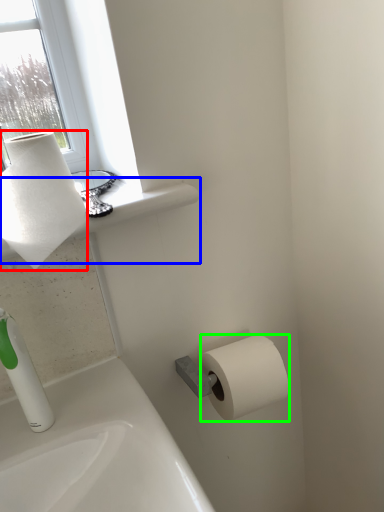
Question: Considering the real-world distances, which object is farthest from paper towel (highlighted by a red box)? window sill (highlighted by a blue box) or toilet paper (highlighted by a green box)?

Choices:
 (A) window sill
 (B) toilet paper

Answer: (B)